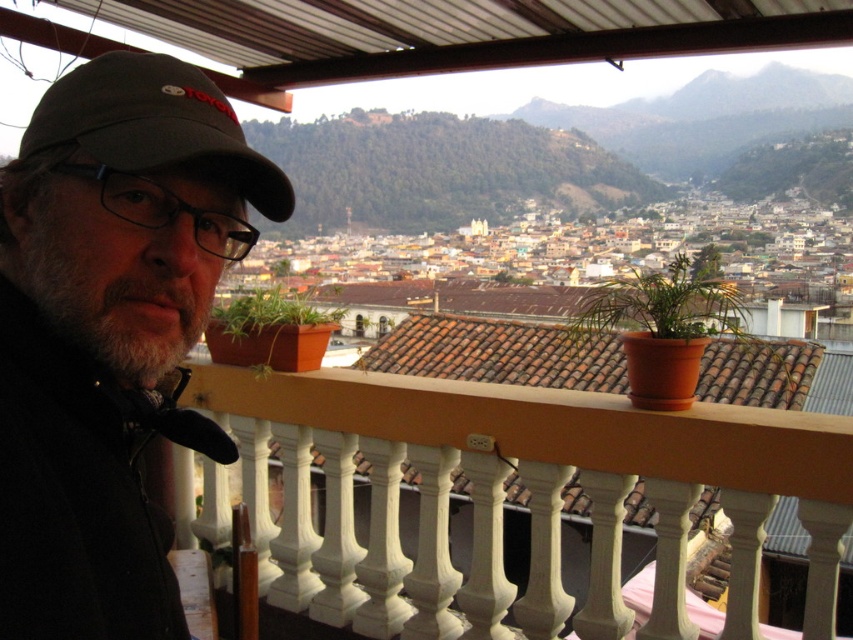
You are a delivery person trying to place a small package on the white painted wood balustrade at center and the green matte plant at center. Which object can the package be placed on if it requires a larger surface area?

The green matte plant at center has a larger size compared to the white painted wood balustrade at center, so the package can be placed on the green matte plant at center.

You are a photographer trying to capture the green matte plant at center without the black matte cap at upper left blocking the view. Based on their heights, can you position yourself so the cap is out of frame while keeping the plant in view?

The black matte cap at upper left is much taller than the green matte plant at center. To avoid the cap blocking the view, position yourself lower so the cap is out of frame while the shorter plant remains visible.

You are a painter standing on the balcony and want to hang a small painting hook on the object that is taller between the white painted wood balustrade at center and the green matte plant at center. Which object should you choose?

The white painted wood balustrade at center is taller than the green matte plant at center, so you should hang the hook on the white painted wood balustrade at center.